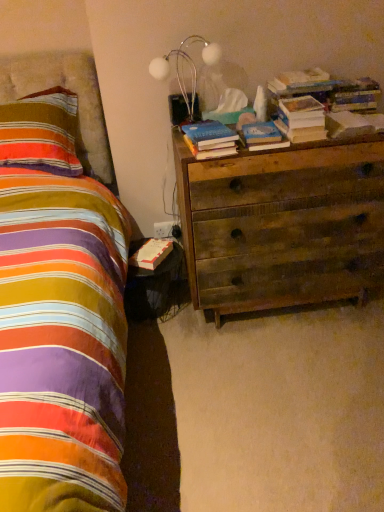
Question: From a real-world perspective, is striped fabric pillow at left physically located above or below hardcover book at upper right, which ranks as the first book in right-to-left order?

Choices:
 (A) below
 (B) above

Answer: (A)

Question: Considering their positions, is striped fabric pillow at left located in front of or behind hardcover book at upper right, which ranks as the first book in right-to-left order?

Choices:
 (A) front
 (B) behind

Answer: (B)

Question: Which object is positioned farthest from the black glossy nightstand at lower left?

Choices:
 (A) hardcover book at bedside, the 1th paperback book in the bottom-to-top sequence
 (B) wooden chest of drawers at right
 (C) hardcover book at upper right, the second book from the left
 (D) hardcover book at center, which is the second paperback book from top to bottom
 (E) hardcover book at center, which is the 1th book in left-to-right order

Answer: (C)

Question: Which of these objects is positioned closest to the hardcover book at center, acting as the second paperback book starting from the bottom?

Choices:
 (A) hardcover book at upper right, which ranks as the second paperback book in back-to-front order
 (B) white matte lamp at upper center
 (C) hardcover book at bedside, the third paperback book positioned from the front
 (D) hardcover book at center, marked as the 2th book in a right-to-left arrangement
 (E) black glossy nightstand at lower left

Answer: (D)